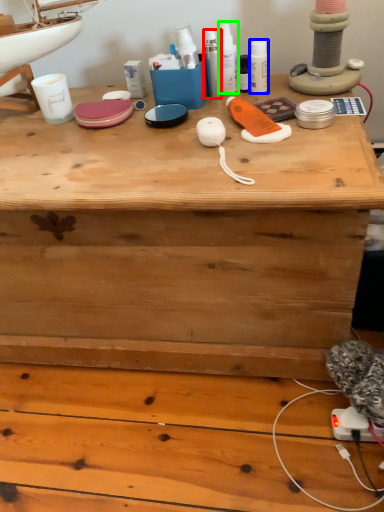
Question: Which is farther away from toiletry (highlighted by a red box)? toiletry (highlighted by a blue box) or toiletry (highlighted by a green box)?

Choices:
 (A) toiletry
 (B) toiletry

Answer: (A)